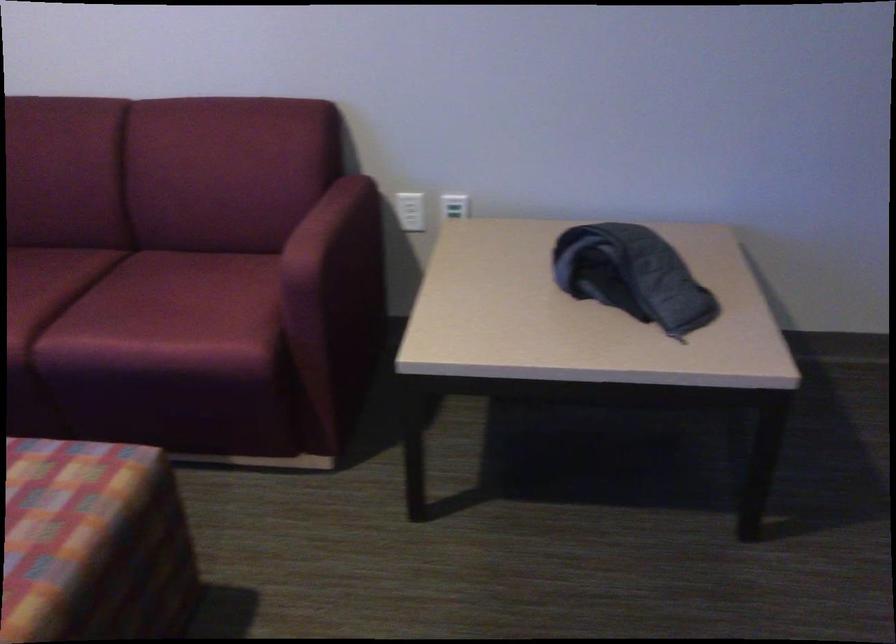
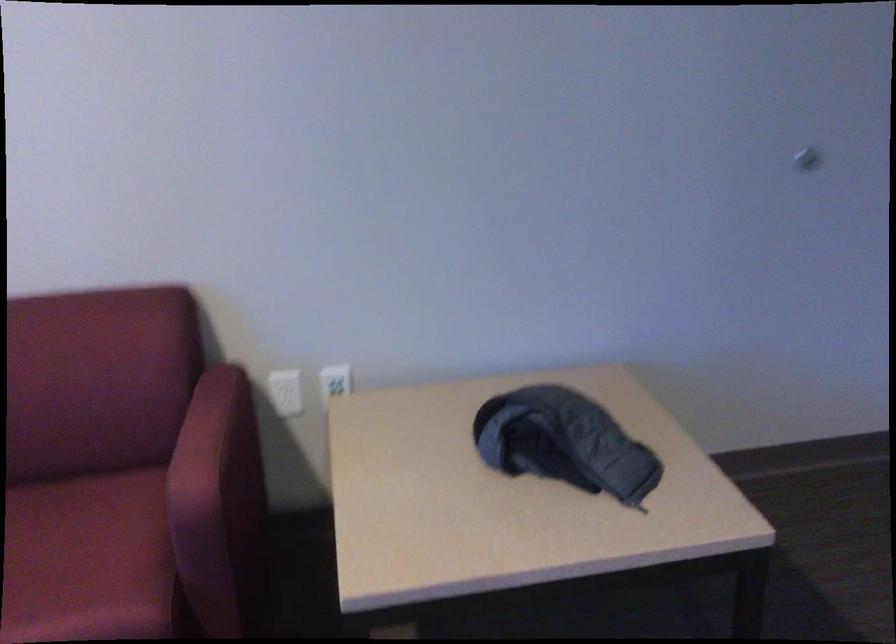
The point at (407,207) is marked in the first image. Where is the corresponding point in the second image?

(286, 392)